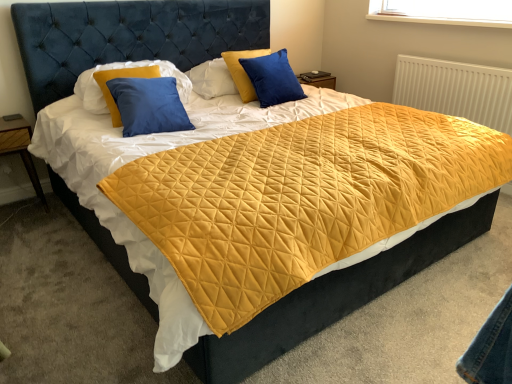
This screenshot has width=512, height=384. In order to click on free area below wooden at left (from a real-world perspective) in this screenshot , I will do `click(22, 205)`.